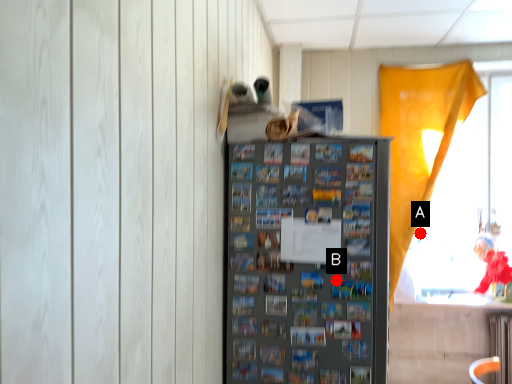
Question: Two points are circled on the image, labeled by A and B beside each circle. Which point is closer to the camera?

Choices:
 (A) A is closer
 (B) B is closer

Answer: (B)